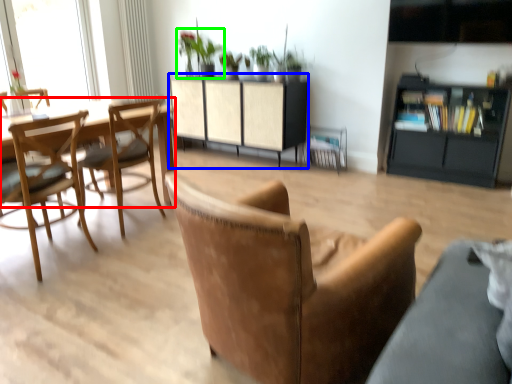
Question: Which object is positioned farthest from round table (highlighted by a red box)? Select from cabinetry (highlighted by a blue box) and houseplant (highlighted by a green box).

Choices:
 (A) cabinetry
 (B) houseplant

Answer: (B)